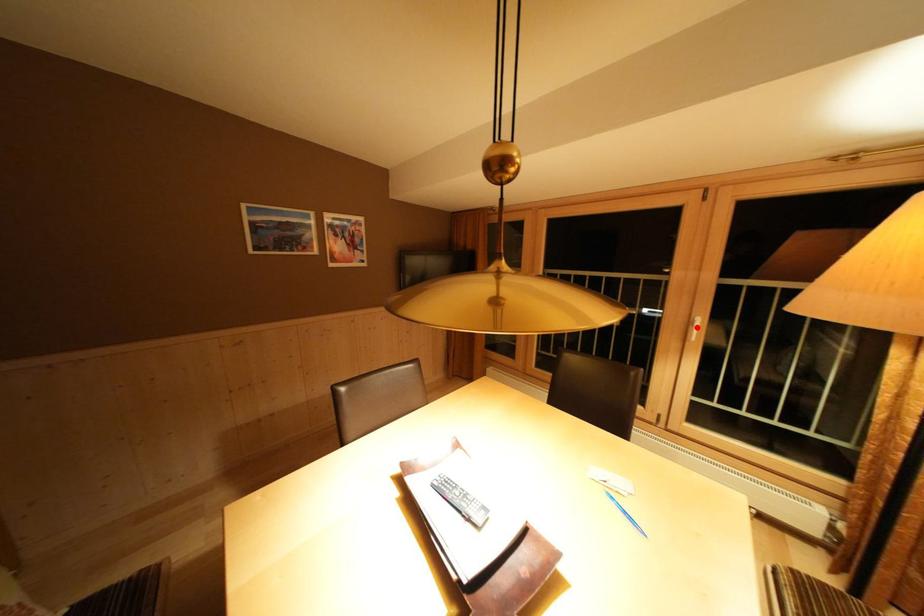
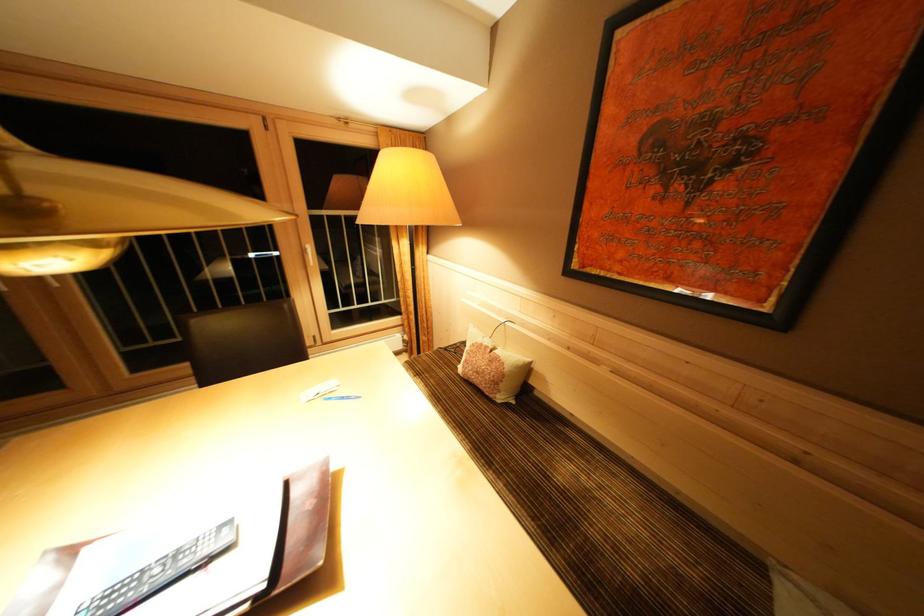
Find the pixel in the second image that matches the highlighted location in the first image.

(310, 256)